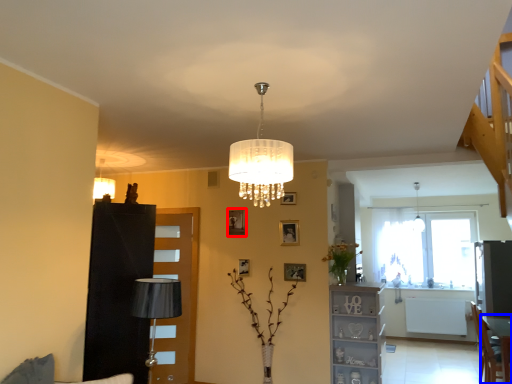
Question: Which object appears farthest to the camera in this image, picture frame (highlighted by a red box) or table (highlighted by a blue box)?

Choices:
 (A) picture frame
 (B) table

Answer: (A)